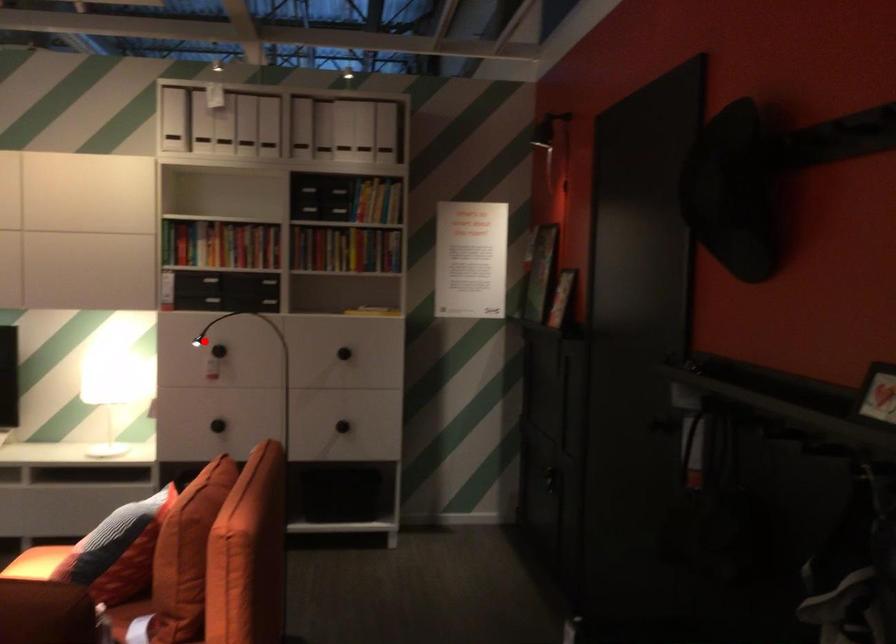
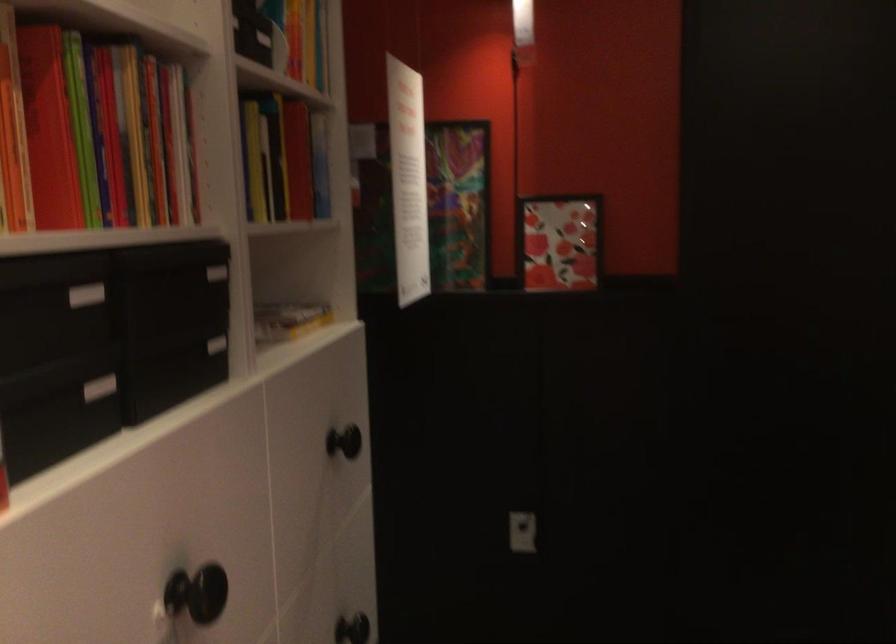
Question: I am providing you with two images of the same scene from different viewpoints. Image1 has a red point marked. In image2, the corresponding 3D location appears at what relative position? Reply with the corresponding letter.

Choices:
 (A) Closer
 (B) Farther

Answer: (A)